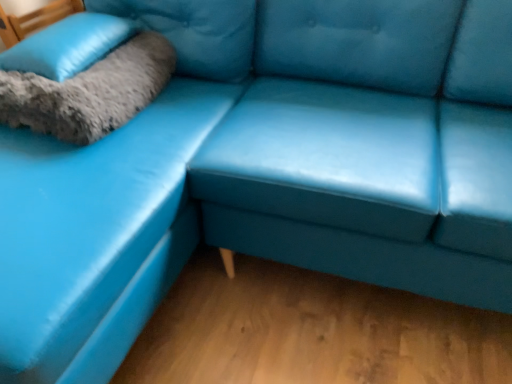
Find the location of a particular element. free location above soft gray fur pillow at upper left (from a real-world perspective) is located at coordinates (82, 27).